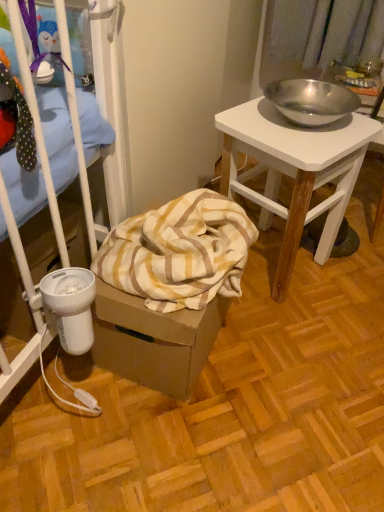
At what (x,y) coordinates should I click in order to perform the action: click on vacant space to the right of polished metal bowl at upper right. Please return your answer as a coordinate pair (x, y). Looking at the image, I should click on (353, 276).